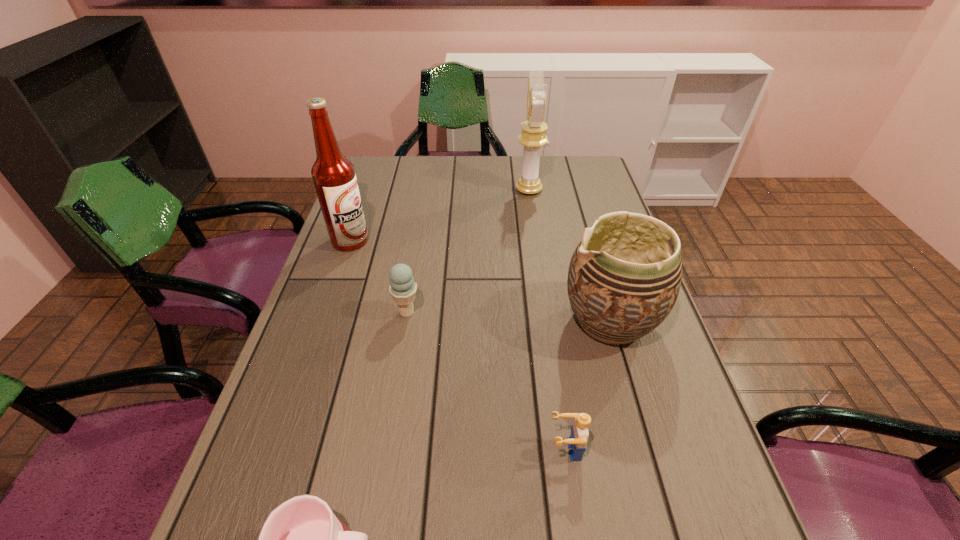
At what (x,y) coordinates should I click in order to perform the action: click on free space at the right edge of the desktop. Please return your answer as a coordinate pair (x, y). Image resolution: width=960 pixels, height=540 pixels. Looking at the image, I should click on (612, 356).

You are a GUI agent. You are given a task and a screenshot of the screen. Output one action in this format:
    pyautogui.click(x=<x>, y=<y>)
    Task: Click on the blank space at the far left corner of the desktop
    Image resolution: width=960 pixels, height=540 pixels.
    Given the screenshot: What is the action you would take?
    pyautogui.click(x=373, y=169)

This screenshot has width=960, height=540. Identify the location of free region at the far right corner of the desktop. (572, 167).

Where is `empty space between the ice cream and the farthest object`? The image size is (960, 540). empty space between the ice cream and the farthest object is located at coordinates click(x=468, y=251).

I want to click on free space between the third shortest object and the fourth shortest object, so click(x=509, y=317).

Locate an element on the screen. free space between the award and the second nearest object is located at coordinates (547, 320).

Where is `empty location between the pottery and the fifth farthest object`? empty location between the pottery and the fifth farthest object is located at coordinates click(588, 385).

The image size is (960, 540). What are the coordinates of `empty location between the farthest object and the third tallest object` in the screenshot? It's located at (569, 255).

Find the location of a particular element. free space between the fifth farthest object and the pottery is located at coordinates (588, 385).

The image size is (960, 540). I want to click on vacant point located between the ice cream and the second farthest object, so 378,276.